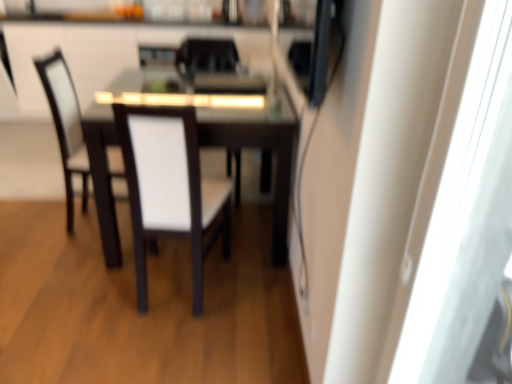
Where is `white fabric chair at center, which is counted as the second chair, starting from the back`? Image resolution: width=512 pixels, height=384 pixels. white fabric chair at center, which is counted as the second chair, starting from the back is located at coordinates (205, 58).

Image resolution: width=512 pixels, height=384 pixels. In order to click on white glossy cabinetry at upper center in this screenshot , I will do `click(106, 53)`.

Does white fabric chair at center, which is the 1th chair from front to back, have a greater height compared to white fabric chair at center, marked as the third chair in a back-to-front arrangement?

Correct, white fabric chair at center, which is the 1th chair from front to back, is much taller as white fabric chair at center, marked as the third chair in a back-to-front arrangement.

Is white fabric chair at center, the fourth chair from the back, closer to the viewer compared to white fabric chair at center, the 2th chair when ordered from front to back?

Yes, the depth of white fabric chair at center, the fourth chair from the back, is less than that of white fabric chair at center, the 2th chair when ordered from front to back.

From the image's perspective, is transparent plastic screen door at right located above or below white fabric chair at center, acting as the fourth chair starting from the front?

transparent plastic screen door at right is below white fabric chair at center, acting as the fourth chair starting from the front.

Can you confirm if transparent plastic screen door at right is taller than white fabric chair at center, acting as the fourth chair starting from the front?

Yes.

From a real-world perspective, is transparent plastic screen door at right above or below white fabric chair at center, the first chair from the back?

transparent plastic screen door at right is situated lower than white fabric chair at center, the first chair from the back, in the real world.

Locate an element on the screen. screen door below the white fabric chair at center, acting as the fourth chair starting from the front (from a real-world perspective) is located at coordinates (465, 219).

Between white fabric chair at center, which is the 1th chair from front to back, and transparent plastic screen door at right, which one appears on the right side from the viewer's perspective?

From the viewer's perspective, transparent plastic screen door at right appears more on the right side.

Is white fabric chair at center, which is the 1th chair from front to back, taller or shorter than transparent plastic screen door at right?

Clearly, white fabric chair at center, which is the 1th chair from front to back, is shorter compared to transparent plastic screen door at right.

Which object is thinner, white fabric chair at center, the fourth chair from the back, or transparent plastic screen door at right?

Thinner between the two is transparent plastic screen door at right.

Is white fabric chair at center, the fourth chair from the back, bigger or smaller than transparent plastic screen door at right?

Clearly, white fabric chair at center, the fourth chair from the back, is larger in size than transparent plastic screen door at right.

Is white glossy cabinetry at upper center to the left of white fabric chair at center, the first chair from the back, from the viewer's perspective?

Indeed, white glossy cabinetry at upper center is positioned on the left side of white fabric chair at center, the first chair from the back.

The width and height of the screenshot is (512, 384). There is a white glossy cabinetry at upper center. Find the location of `the 1st chair below it (from the image's perspective)`. the 1st chair below it (from the image's perspective) is located at coordinates (206, 57).

In the scene shown: Would you consider white glossy cabinetry at upper center to be distant from white fabric chair at center, acting as the fourth chair starting from the front?

white glossy cabinetry at upper center is actually quite close to white fabric chair at center, acting as the fourth chair starting from the front.

Does white glossy cabinetry at upper center have a lesser width compared to white fabric chair at center, acting as the fourth chair starting from the front?

In fact, white glossy cabinetry at upper center might be wider than white fabric chair at center, acting as the fourth chair starting from the front.

Is white fabric chair at center, which is the 1th chair from front to back, at the back of white glossy cabinetry at upper center?

No, white glossy cabinetry at upper center's orientation is not away from white fabric chair at center, which is the 1th chair from front to back.

How many degrees apart are the facing directions of white glossy cabinetry at upper center and white fabric chair at center, the fourth chair from the back?

The angular difference between white glossy cabinetry at upper center and white fabric chair at center, the fourth chair from the back, is 174 degrees.

Between white glossy cabinetry at upper center and white fabric chair at center, the fourth chair from the back, which one has more height?

With more height is white fabric chair at center, the fourth chair from the back.

In the scene shown: Is white glossy cabinetry at upper center outside of white fabric chair at center, the fourth chair from the back?

That's correct, white glossy cabinetry at upper center is outside of white fabric chair at center, the fourth chair from the back.

How many degrees apart are the facing directions of dark wood table at center and white glossy cabinetry at upper center?

There is a 88.8-degree angle between the facing directions of dark wood table at center and white glossy cabinetry at upper center.

Is dark wood table at center in contact with white glossy cabinetry at upper center?

They are not placed beside each other.

Between dark wood table at center and white glossy cabinetry at upper center, which one has more height?

white glossy cabinetry at upper center.

From a real-world perspective, between dark wood table at center and white glossy cabinetry at upper center, who is vertically higher?

From a 3D spatial view, white glossy cabinetry at upper center is above.

Measure the distance between white fabric chair at center, marked as the third chair in a back-to-front arrangement, and white fabric chair at center, the first chair from the back.

white fabric chair at center, marked as the third chair in a back-to-front arrangement, is 29.56 inches away from white fabric chair at center, the first chair from the back.

Is white fabric chair at center, marked as the third chair in a back-to-front arrangement, facing away from white fabric chair at center, acting as the fourth chair starting from the front?

white fabric chair at center, marked as the third chair in a back-to-front arrangement, is not turned away from white fabric chair at center, acting as the fourth chair starting from the front.

Which is in front, point (47, 78) or point (214, 43)?

Point (47, 78)

From the image's perspective, is white fabric chair at center, marked as the third chair in a back-to-front arrangement, above white fabric chair at center, acting as the fourth chair starting from the front?

Incorrect, from the image's perspective, white fabric chair at center, marked as the third chair in a back-to-front arrangement, is lower than white fabric chair at center, acting as the fourth chair starting from the front.

Locate an element on the screen. Image resolution: width=512 pixels, height=384 pixels. chair below the white fabric chair at center, marked as the third chair in a back-to-front arrangement (from the image's perspective) is located at coordinates (169, 188).

Find the location of `chair above the transparent plastic screen door at right (from a real-world perspective)`. chair above the transparent plastic screen door at right (from a real-world perspective) is located at coordinates (206, 57).

Estimate the real-world distances between objects in this image. Which object is closer to white fabric chair at center, which is the 1th chair from front to back, white glossy cabinetry at upper center or dark wood table at center?

dark wood table at center is positioned closer to the anchor white fabric chair at center, which is the 1th chair from front to back.

Which object lies further to the anchor point dark wood table at center, white fabric chair at center, which is the 1th chair from front to back, or white glossy cabinetry at upper center?

white glossy cabinetry at upper center.

Looking at this image, which object lies nearer to the anchor point white glossy cabinetry at upper center, dark wood table at center or white fabric chair at center, the 2th chair when ordered from front to back?

white fabric chair at center, the 2th chair when ordered from front to back.

From the image, which object appears to be farther from white fabric chair at center, the 2th chair when ordered from front to back, transparent plastic screen door at right or white fabric chair at center, which is the 1th chair from front to back?

Based on the image, transparent plastic screen door at right appears to be further to white fabric chair at center, the 2th chair when ordered from front to back.

Estimate the real-world distances between objects in this image. Which object is closer to white fabric chair at center, acting as the fourth chair starting from the front, white glossy cabinetry at upper center or dark wood table at center?

The object closer to white fabric chair at center, acting as the fourth chair starting from the front, is dark wood table at center.

Considering their positions, is dark wood table at center positioned further to transparent plastic screen door at right than white fabric chair at center, the first chair from the back?

white fabric chair at center, the first chair from the back, lies further to transparent plastic screen door at right than the other object.

Looking at the image, which one is located closer to white fabric chair at center, marked as the third chair in a back-to-front arrangement, dark wood table at center or transparent plastic screen door at right?

dark wood table at center is closer to white fabric chair at center, marked as the third chair in a back-to-front arrangement.

Based on their spatial positions, is white glossy cabinetry at upper center or transparent plastic screen door at right closer to white fabric chair at center, the fourth chair from the back?

transparent plastic screen door at right lies closer to white fabric chair at center, the fourth chair from the back, than the other object.

You are a GUI agent. You are given a task and a screenshot of the screen. Output one action in this format:
    pyautogui.click(x=<x>, y=<y>)
    Task: Click on the chair between white fabric chair at center, the 2th chair when ordered from front to back, and dark wood table at center from left to right
    
    Given the screenshot: What is the action you would take?
    pyautogui.click(x=169, y=188)

The image size is (512, 384). In order to click on chair between white fabric chair at center, marked as the third chair in a back-to-front arrangement, and white fabric chair at center, the first chair from the back, along the z-axis in this screenshot , I will do `click(205, 58)`.

Locate an element on the screen. table located between white fabric chair at center, which is the 1th chair from front to back, and white fabric chair at center, acting as the third chair starting from the front, in the depth direction is located at coordinates (257, 147).

Locate an element on the screen. table between white fabric chair at center, the fourth chair from the back, and white fabric chair at center, acting as the fourth chair starting from the front, from front to back is located at coordinates (257, 147).